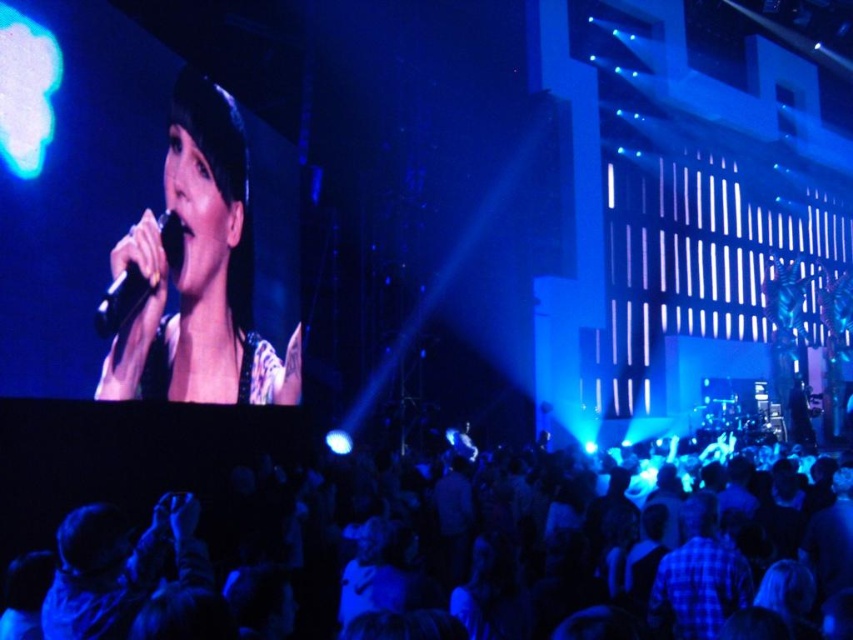
Is the position of black fabric crowd at lower center less distant than that of black glossy microphone at upper left?

Yes.

Who is lower down, black fabric crowd at lower center or black glossy microphone at upper left?

black fabric crowd at lower center is below.

Is point (289, 470) closer to viewer compared to point (158, 225)?

That is False.

Where is `black fabric crowd at lower center`? black fabric crowd at lower center is located at coordinates (138, 500).

Does matte black microphone at upper left have a larger size compared to black glossy microphone at upper left?

Yes.

Between matte black microphone at upper left and black glossy microphone at upper left, which one is positioned lower?

Positioned lower is black glossy microphone at upper left.

Does point (190, 115) come in front of point (114, 316)?

No, (190, 115) is behind (114, 316).

Locate an element on the screen. The image size is (853, 640). matte black microphone at upper left is located at coordinates (195, 273).

Is point (555, 600) more distant than point (177, 324)?

No, it is in front of (177, 324).

Is black fabric crowd at lower center thinner than matte black microphone at upper left?

In fact, black fabric crowd at lower center might be wider than matte black microphone at upper left.

Find the location of `black fabric crowd at lower center`. black fabric crowd at lower center is located at coordinates (138, 500).